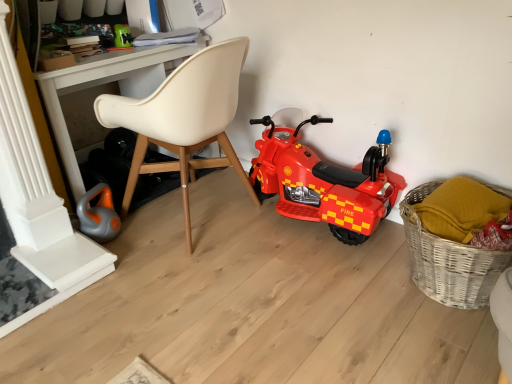
Find the location of `free space between red plastic toy motorcycle at center and woven wicker basket at lower right`. free space between red plastic toy motorcycle at center and woven wicker basket at lower right is located at coordinates (354, 251).